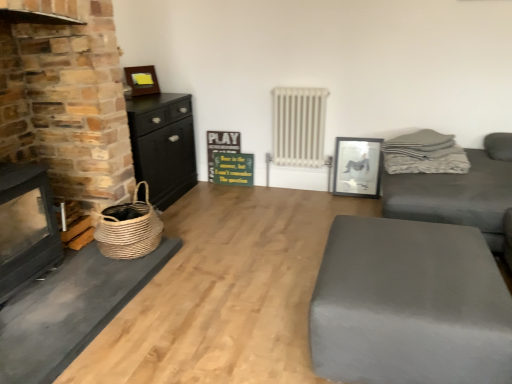
Question: Would you consider woven straw basket at left to be distant from brick fireplace at left?

Choices:
 (A) yes
 (B) no

Answer: (B)

Question: From a real-world perspective, does woven straw basket at left sit lower than brick fireplace at left?

Choices:
 (A) yes
 (B) no

Answer: (A)

Question: From a real-world perspective, is woven straw basket at left physically above brick fireplace at left?

Choices:
 (A) no
 (B) yes

Answer: (A)

Question: Considering the relative sizes of woven straw basket at left and brick fireplace at left in the image provided, is woven straw basket at left thinner than brick fireplace at left?

Choices:
 (A) no
 (B) yes

Answer: (B)

Question: Is woven straw basket at left wider than brick fireplace at left?

Choices:
 (A) no
 (B) yes

Answer: (A)

Question: Is woven straw basket at left oriented towards brick fireplace at left?

Choices:
 (A) no
 (B) yes

Answer: (B)

Question: Is woven straw basket at left wider than matte gray ottoman at lower right?

Choices:
 (A) no
 (B) yes

Answer: (A)

Question: Can you confirm if woven straw basket at left is smaller than matte gray ottoman at lower right?

Choices:
 (A) yes
 (B) no

Answer: (A)

Question: From the image's perspective, is woven straw basket at left located above matte gray ottoman at lower right?

Choices:
 (A) yes
 (B) no

Answer: (A)

Question: Is matte gray ottoman at lower right at the back of woven straw basket at left?

Choices:
 (A) no
 (B) yes

Answer: (A)

Question: Is woven straw basket at left thinner than matte gray ottoman at lower right?

Choices:
 (A) yes
 (B) no

Answer: (A)

Question: Is the depth of woven straw basket at left greater than that of matte gray ottoman at lower right?

Choices:
 (A) yes
 (B) no

Answer: (A)

Question: Does white metallic radiator at center have a greater width compared to gray fabric couch at right?

Choices:
 (A) no
 (B) yes

Answer: (A)